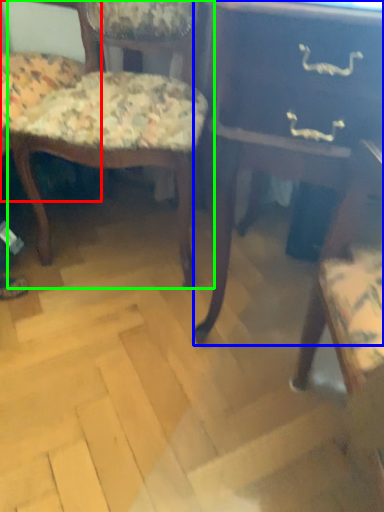
Question: Which object is the closest to the chair (highlighted by a red box)? Choose among these: table (highlighted by a blue box) or chair (highlighted by a green box).

Choices:
 (A) table
 (B) chair

Answer: (B)